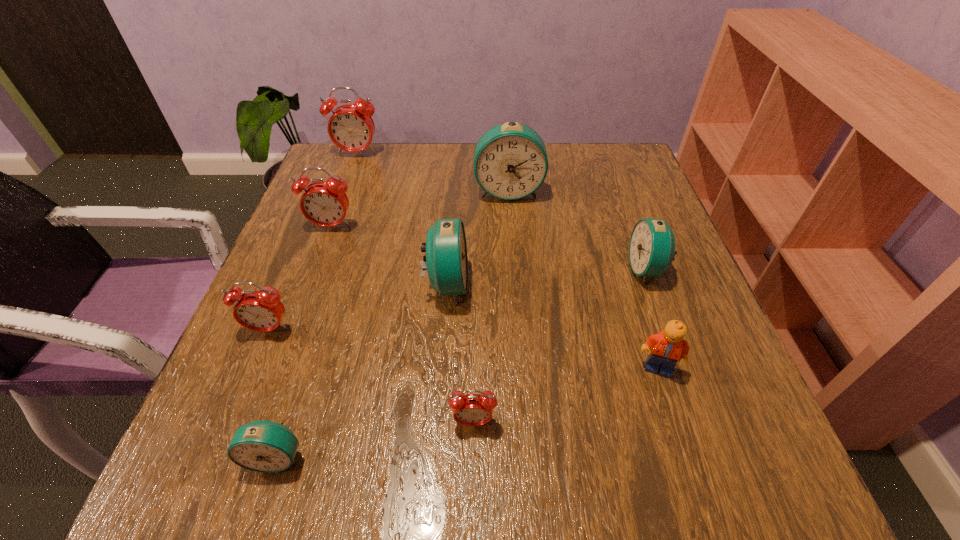
This screenshot has width=960, height=540. Identify the location of free space located 0.140m on the face of the sixth nearest alarm clock. (312, 280).

Where is `free location located 0.290m on the front-facing side of the rightmost alarm clock`? The image size is (960, 540). free location located 0.290m on the front-facing side of the rightmost alarm clock is located at coordinates (483, 269).

Locate an element on the screen. The image size is (960, 540). free space located 0.240m on the front-facing side of the rightmost alarm clock is located at coordinates (509, 269).

Find the location of a particular element. This screenshot has width=960, height=540. vacant space located on the front-facing side of the rightmost alarm clock is located at coordinates (463, 269).

Find the location of `vacant position located on the face of the third biggest red alarm clock`. vacant position located on the face of the third biggest red alarm clock is located at coordinates (231, 420).

Find the location of `free region located on the front-facing side of the third nearest object`. free region located on the front-facing side of the third nearest object is located at coordinates coord(684,446).

Identify the location of vacant space located on the face of the seventh farthest alarm clock. The height and width of the screenshot is (540, 960). (472, 504).

I want to click on object at the near edge, so click(265, 446).

The height and width of the screenshot is (540, 960). Identify the location of alarm clock located in the right edge section of the desktop. pos(652,243).

Identify the location of Lego present at the right edge. (668, 347).